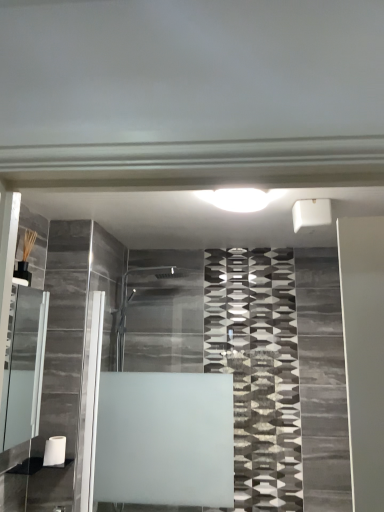
This screenshot has height=512, width=384. What do you see at coordinates (240, 198) in the screenshot?
I see `white glossy light at center` at bounding box center [240, 198].

The image size is (384, 512). I want to click on white matte toilet paper at lower left, so click(55, 451).

This screenshot has width=384, height=512. Find the location of `white glossy light at center`. white glossy light at center is located at coordinates (240, 198).

Which of these two, matte glass cabinet at left or white glossy light at center, is bigger?

matte glass cabinet at left is bigger.

Which is closer to the camera, (10, 361) or (265, 197)?

Point (10, 361).

From a real-world perspective, is matte glass cabinet at left below white glossy light at center?

Indeed, from a real-world perspective, matte glass cabinet at left is positioned beneath white glossy light at center.

How many degrees apart are the facing directions of matte glass cabinet at left and white glossy light at center?

They differ by 89.5 degrees in their facing directions.

Does white matte toilet paper at lower left have a greater height compared to frosted glass shower door at center?

No.

Is white matte toilet paper at lower left not within frosted glass shower door at center?

Absolutely, white matte toilet paper at lower left is external to frosted glass shower door at center.

From the image's perspective, which one is positioned higher, white matte toilet paper at lower left or frosted glass shower door at center?

frosted glass shower door at center is shown above in the image.

Is matte glass cabinet at left facing towards white matte toilet paper at lower left?

No, matte glass cabinet at left is not turned towards white matte toilet paper at lower left.

Between matte glass cabinet at left and white matte toilet paper at lower left, which one has less height?

Standing shorter between the two is white matte toilet paper at lower left.

Are matte glass cabinet at left and white matte toilet paper at lower left beside each other?

No.

Is point (12, 373) in front of point (44, 455)?

Yes, it is.

Which object is closer to the camera, white glossy light at center or frosted glass shower door at center?

white glossy light at center.

Considering the relative positions of white glossy light at center and frosted glass shower door at center in the image provided, is white glossy light at center to the left of frosted glass shower door at center from the viewer's perspective?

No, white glossy light at center is not to the left of frosted glass shower door at center.

Is white glossy light at center next to frosted glass shower door at center?

white glossy light at center and frosted glass shower door at center are clearly separated.

In the scene shown: Is matte glass cabinet at left at the back of white glossy light at center?

white glossy light at center does not have its back to matte glass cabinet at left.

Does white glossy light at center touch matte glass cabinet at left?

No, white glossy light at center is not touching matte glass cabinet at left.

Is point (245, 192) less distant than point (30, 291)?

Yes.

Can you confirm if white glossy light at center is thinner than matte glass cabinet at left?

In fact, white glossy light at center might be wider than matte glass cabinet at left.

Is white matte toilet paper at lower left facing towards white glossy light at center?

No, white matte toilet paper at lower left is not oriented towards white glossy light at center.

Which is farther, (63, 439) or (253, 200)?

The point (63, 439) is behind.

From the image's perspective, which one is positioned higher, white matte toilet paper at lower left or white glossy light at center?

From the image's view, white glossy light at center is above.

Is white matte toilet paper at lower left taller or shorter than white glossy light at center?

Clearly, white matte toilet paper at lower left is taller compared to white glossy light at center.

Does matte glass cabinet at left appear on the left side of frosted glass shower door at center?

Correct, you'll find matte glass cabinet at left to the left of frosted glass shower door at center.

Consider the image. Does matte glass cabinet at left contain frosted glass shower door at center?

No, frosted glass shower door at center is not a part of matte glass cabinet at left.

Considering the sizes of objects matte glass cabinet at left and frosted glass shower door at center in the image provided, who is wider, matte glass cabinet at left or frosted glass shower door at center?

matte glass cabinet at left is wider.

Could you tell me if matte glass cabinet at left is facing frosted glass shower door at center?

No, matte glass cabinet at left is not facing towards frosted glass shower door at center.

You are a GUI agent. You are given a task and a screenshot of the screen. Output one action in this format:
    pyautogui.click(x=<x>, y=<y>)
    Task: Click on the light above the matte glass cabinet at left (from a real-world perspective)
    Image resolution: width=384 pixels, height=512 pixels.
    Given the screenshot: What is the action you would take?
    pyautogui.click(x=240, y=198)

You are a GUI agent. You are given a task and a screenshot of the screen. Output one action in this format:
    pyautogui.click(x=<x>, y=<y>)
    Task: Click on the bath located on the right of white matte toilet paper at lower left
    
    Given the screenshot: What is the action you would take?
    pyautogui.click(x=165, y=439)

From the picture: When comparing their distances from white glossy light at center, does white matte toilet paper at lower left or matte glass cabinet at left seem closer?

matte glass cabinet at left.

Estimate the real-world distances between objects in this image. Which object is further from white glossy light at center, frosted glass shower door at center or white matte toilet paper at lower left?

white matte toilet paper at lower left.

Estimate the real-world distances between objects in this image. Which object is further from matte glass cabinet at left, white glossy light at center or white matte toilet paper at lower left?

white glossy light at center lies further to matte glass cabinet at left than the other object.

From the image, which object appears to be farther from matte glass cabinet at left, frosted glass shower door at center or white glossy light at center?

The object further to matte glass cabinet at left is white glossy light at center.

Considering their positions, is frosted glass shower door at center positioned closer to white glossy light at center than matte glass cabinet at left?

matte glass cabinet at left lies closer to white glossy light at center than the other object.

Estimate the real-world distances between objects in this image. Which object is further from matte glass cabinet at left, frosted glass shower door at center or white matte toilet paper at lower left?

frosted glass shower door at center is positioned further to the anchor matte glass cabinet at left.

Considering their positions, is matte glass cabinet at left positioned closer to white matte toilet paper at lower left than frosted glass shower door at center?

matte glass cabinet at left is closer to white matte toilet paper at lower left.

Based on their spatial positions, is white glossy light at center or matte glass cabinet at left closer to white matte toilet paper at lower left?

matte glass cabinet at left.

This screenshot has height=512, width=384. I want to click on cabinet between white glossy light at center and white matte toilet paper at lower left in the up-down direction, so click(x=25, y=369).

Where is `bath between white glossy light at center and white matte toilet paper at lower left in the up-down direction`? bath between white glossy light at center and white matte toilet paper at lower left in the up-down direction is located at coordinates pyautogui.click(x=165, y=439).

You are a GUI agent. You are given a task and a screenshot of the screen. Output one action in this format:
    pyautogui.click(x=<x>, y=<y>)
    Task: Click on the toilet paper situated between matte glass cabinet at left and frosted glass shower door at center from left to right
    The height and width of the screenshot is (512, 384).
    Given the screenshot: What is the action you would take?
    pyautogui.click(x=55, y=451)

Image resolution: width=384 pixels, height=512 pixels. Identify the location of cabinet between white glossy light at center and frosted glass shower door at center from top to bottom. (25, 369).